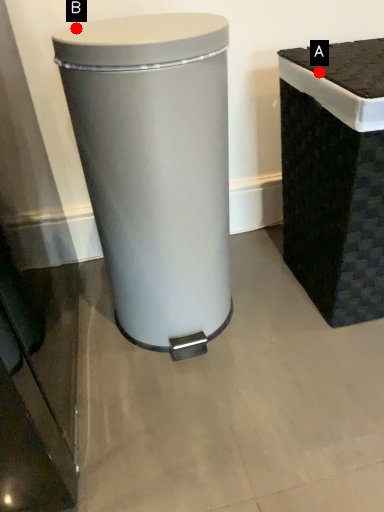
Question: Two points are circled on the image, labeled by A and B beside each circle. Which point is closer to the camera?

Choices:
 (A) A is closer
 (B) B is closer

Answer: (B)